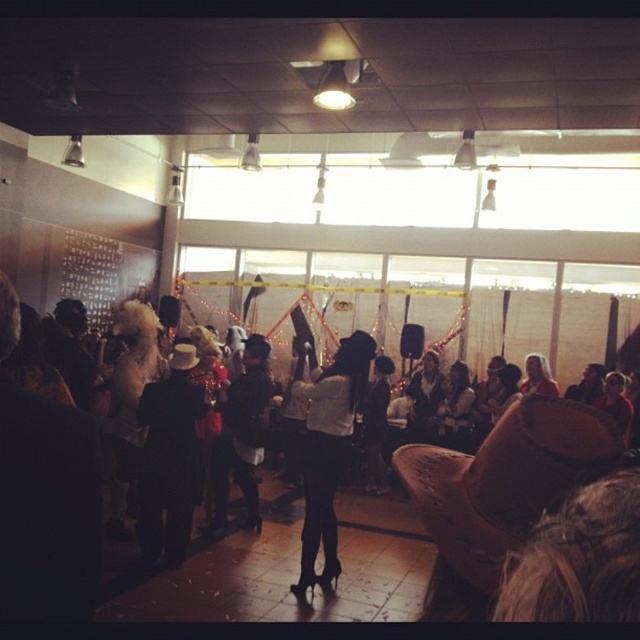
Question: Among these objects, which one is nearest to the camera?

Choices:
 (A) black leather jacket at center
 (B) black matte suit at center
 (C) white matte jacket at center

Answer: (C)

Question: Which point is closer to the camera taking this photo?

Choices:
 (A) (225, 497)
 (B) (337, 532)

Answer: (B)

Question: Which point is farther to the camera?

Choices:
 (A) (168, 422)
 (B) (230, 403)
 (C) (310, 568)

Answer: (B)

Question: Does black matte suit at center appear on the left side of white matte jacket at center?

Choices:
 (A) no
 (B) yes

Answer: (B)

Question: Considering the relative positions of black matte suit at center and black leather jacket at center in the image provided, where is black matte suit at center located with respect to black leather jacket at center?

Choices:
 (A) above
 (B) below

Answer: (A)

Question: Can you confirm if white matte jacket at center is smaller than black leather jacket at center?

Choices:
 (A) no
 (B) yes

Answer: (A)